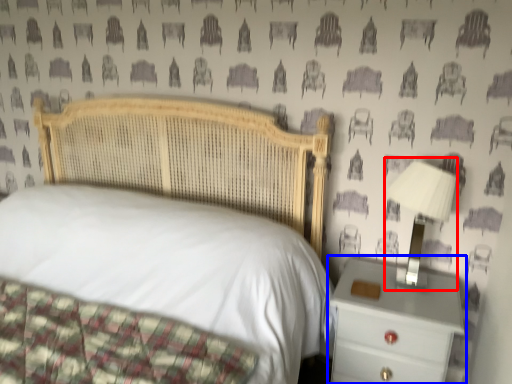
Question: Which object appears closest to the camera in this image, bedside lamp (highlighted by a red box) or nightstand (highlighted by a blue box)?

Choices:
 (A) bedside lamp
 (B) nightstand

Answer: (B)